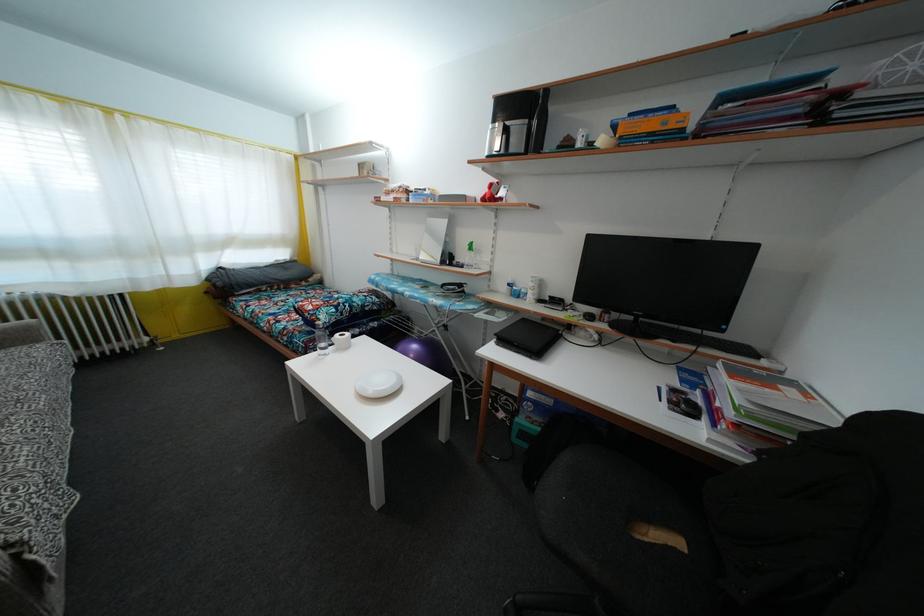
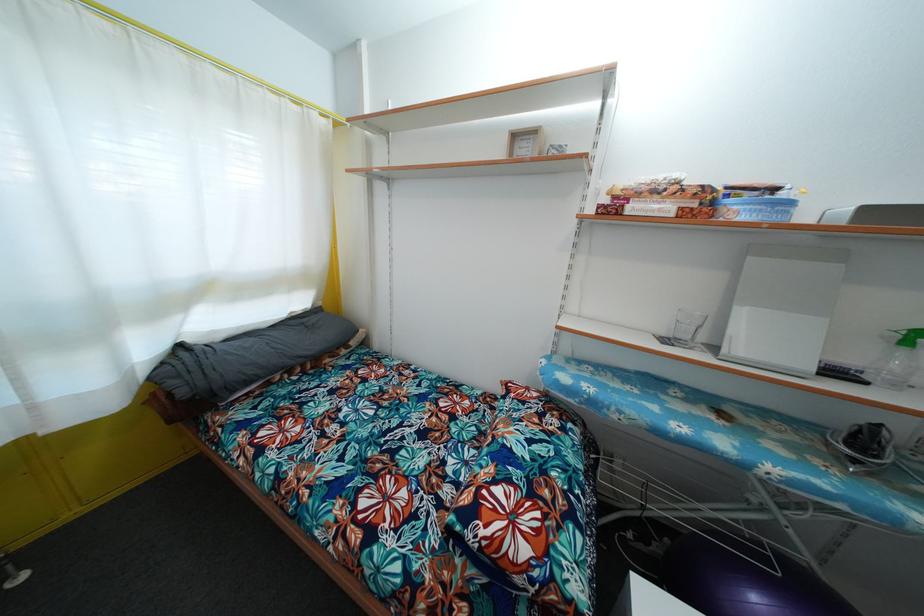
In the second image, find the point that corresponds to the point at 224,291 in the first image.

(187, 399)